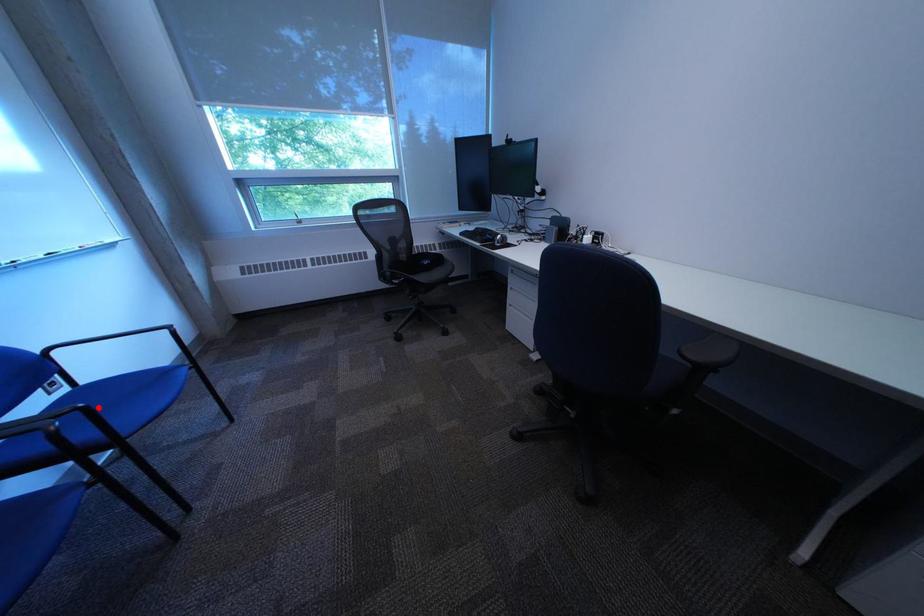
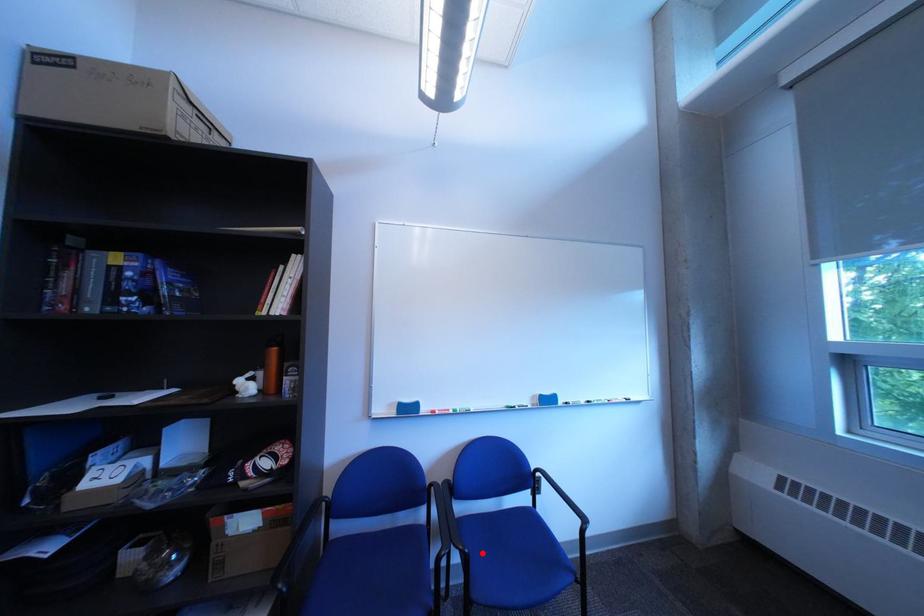
I am providing you with two images of the same scene from different viewpoints. A red point is marked on the first image and another point is marked on the second image. Are the points marked in image1 and image2 representing the same 3D position?

Yes